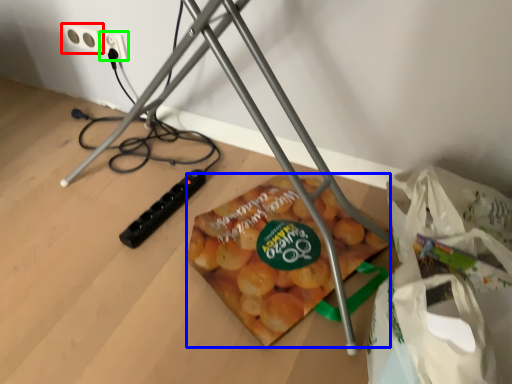
Question: Estimate the real-world distances between objects in this image. Which object is farther from power plugs and sockets (highlighted by a red box), snack (highlighted by a blue box) or power plugs and sockets (highlighted by a green box)?

Choices:
 (A) snack
 (B) power plugs and sockets

Answer: (A)